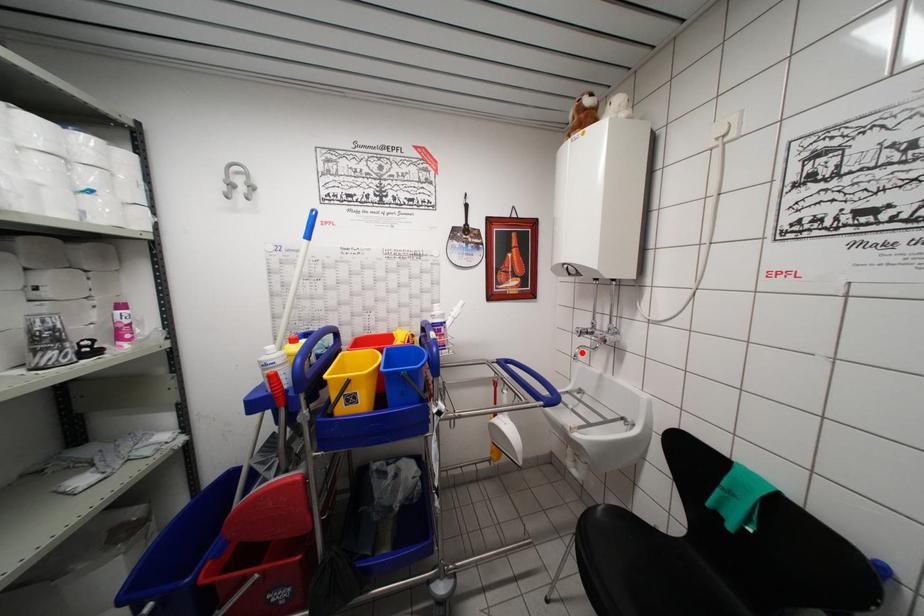
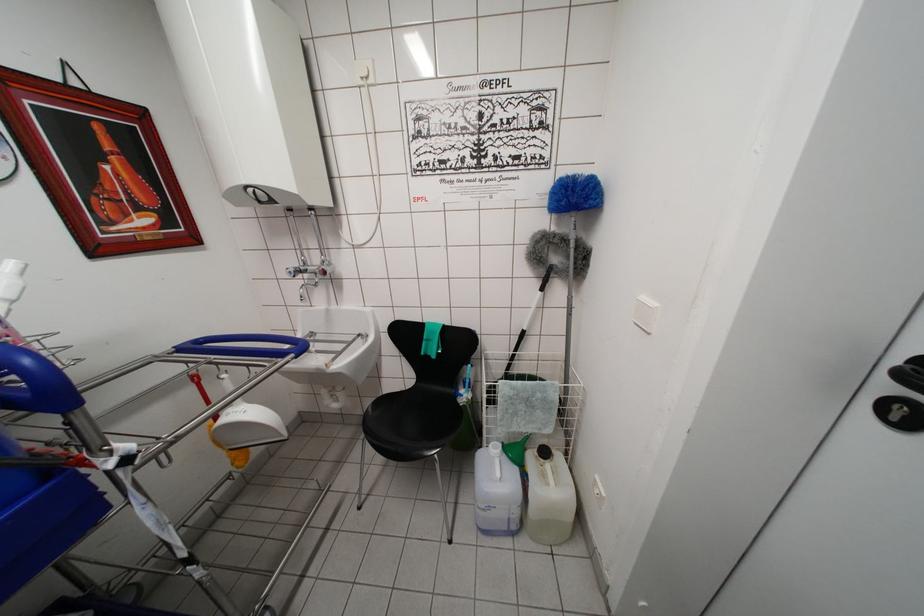
The point at the highlighted location is marked in the first image. Where is the corresponding point in the second image?

(305, 292)